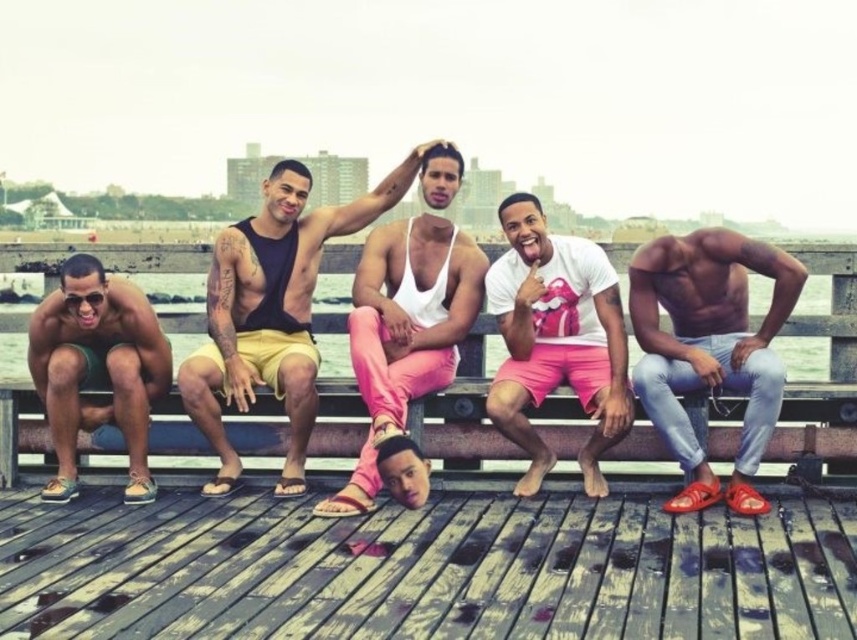
You are standing at the edge of the pier and want to walk to the weathered wood dock at lower center. According to the coordinates provided, where exactly should you head?

The weathered wood dock at lower center is located at coordinates point (423,570), so you should head to that specific point to reach it.

Consider the image. You are a photographer planning to take a portrait of the group. You want to ensure that the white matte tank top at center and the green canvas shorts at left are both clearly visible in the frame. Given their sizes, which clothing item should you focus on to ensure both are in focus?

The white matte tank top at center has a smaller size compared to green canvas shorts at left. To ensure both are in focus, you should focus on the green canvas shorts at left since it is larger and will be easier to capture clearly.